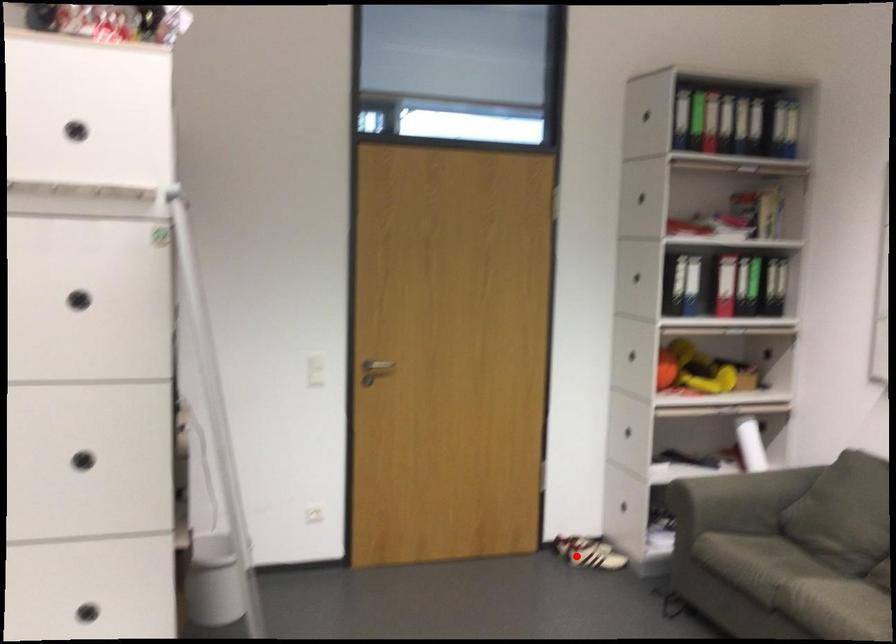
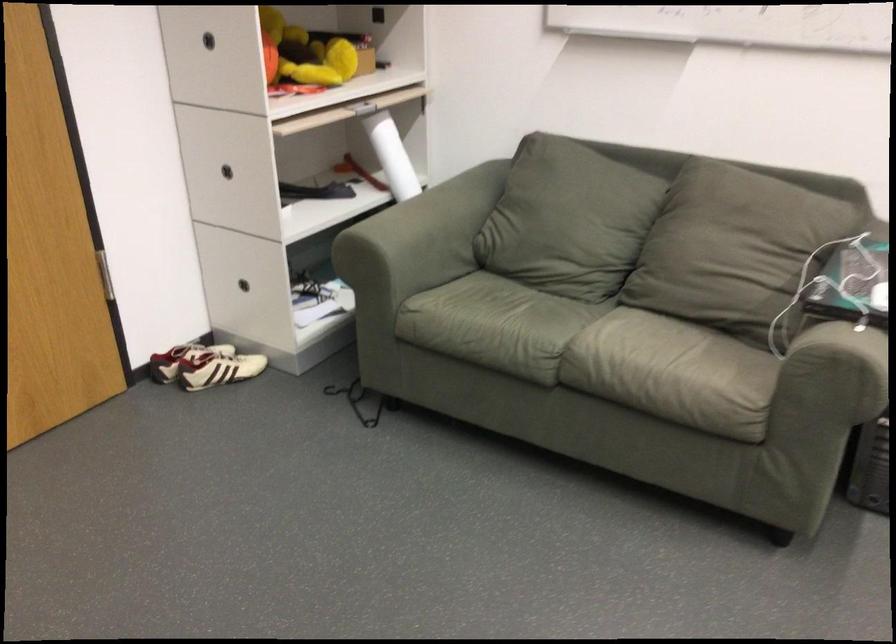
Question: I am providing you with two images of the same scene from different viewpoints. A red point is marked on the first image. Can you still see the location of the red point in image 2?

Choices:
 (A) Yes
 (B) No

Answer: (A)